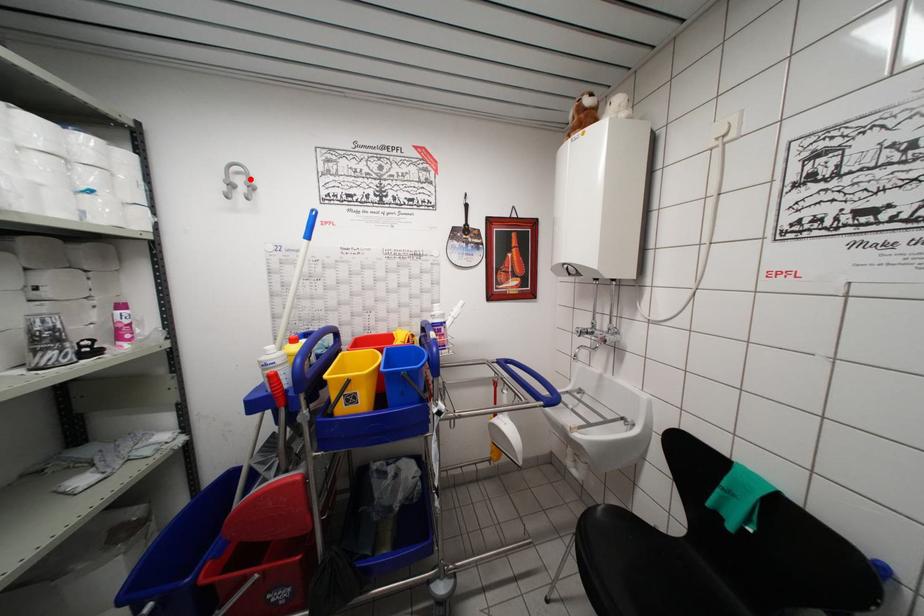
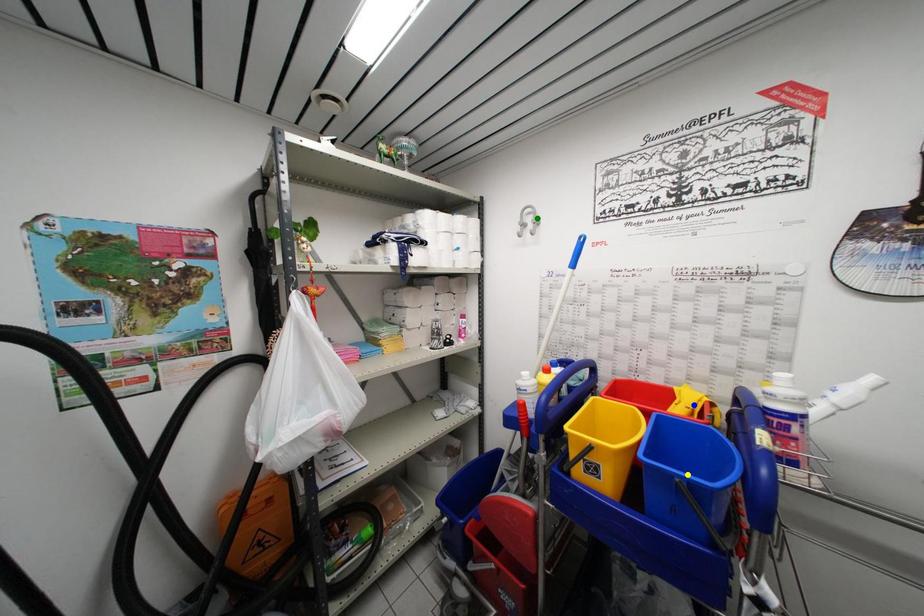
Question: I am providing you with two images of the same scene from different viewpoints. A red point is marked on the first image. You are given multiple points on the second image. In image 2, which mark is for the same physical point as the one in image 1?

Choices:
 (A) yellow point
 (B) blue point
 (C) green point

Answer: (C)